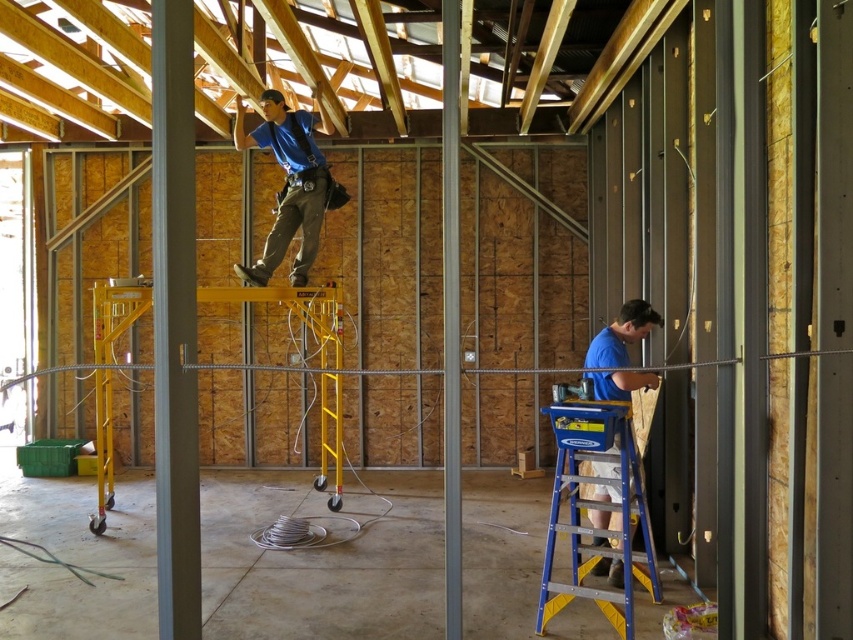
Question: Can you confirm if blue fabric construction worker at upper center is smaller than blue matte shirt at lower right?

Choices:
 (A) no
 (B) yes

Answer: (A)

Question: Can you confirm if yellow metallic ladder at center is wider than blue matte shirt at lower right?

Choices:
 (A) no
 (B) yes

Answer: (B)

Question: Which of the following is the farthest from the observer?

Choices:
 (A) (602, 490)
 (B) (596, 401)

Answer: (A)

Question: Which point is closer to the camera taking this photo?

Choices:
 (A) (624, 378)
 (B) (294, 200)

Answer: (A)

Question: Among these points, which one is nearest to the camera?

Choices:
 (A) (271, 250)
 (B) (590, 422)
 (C) (126, 328)
 (D) (630, 317)

Answer: (B)

Question: Is blue fabric construction worker at upper center in front of blue matte shirt at lower right?

Choices:
 (A) no
 (B) yes

Answer: (A)